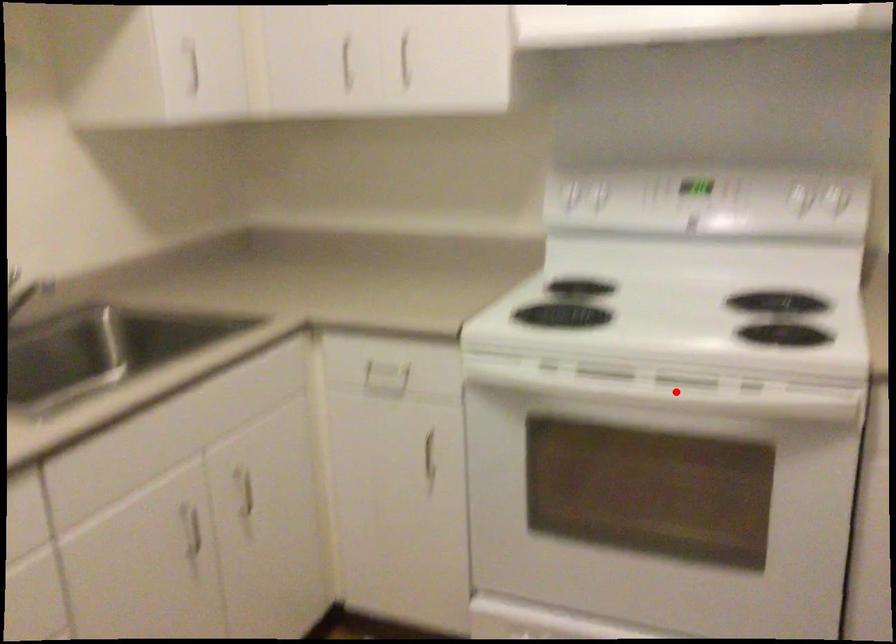
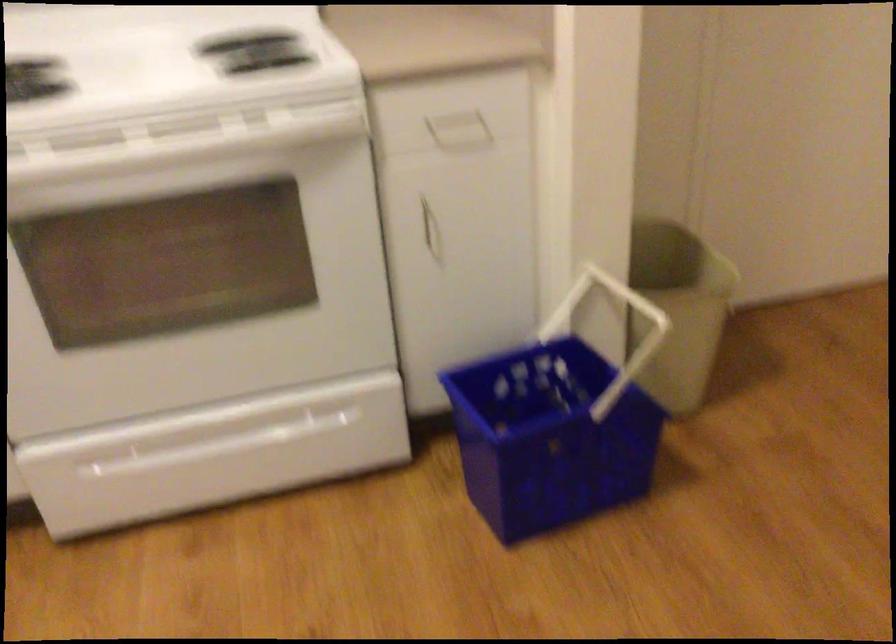
Question: I am providing you with two images of the same scene from different viewpoints. In image1, a red point is highlighted. Considering the same 3D point in image2, which of the following is correct?

Choices:
 (A) It is closer
 (B) It is farther

Answer: (A)